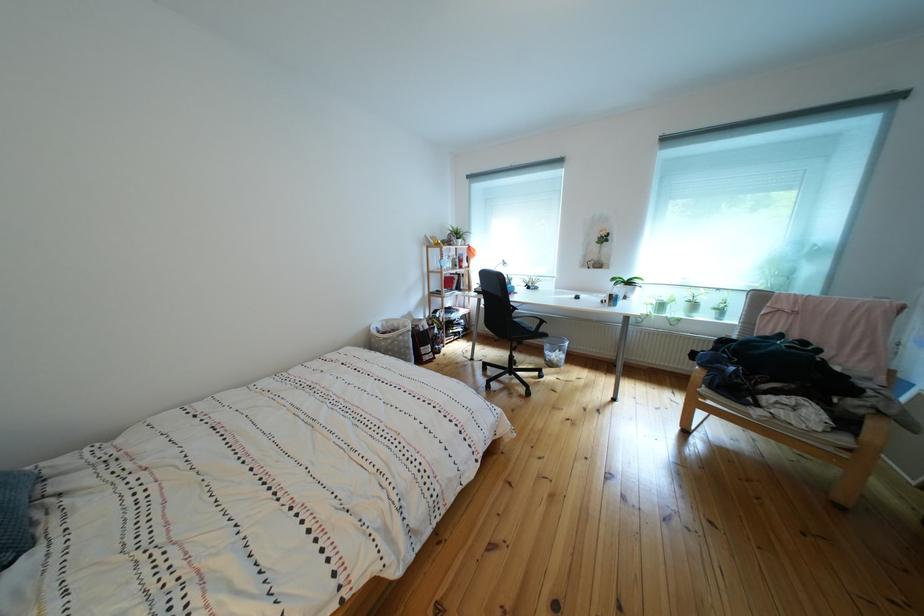
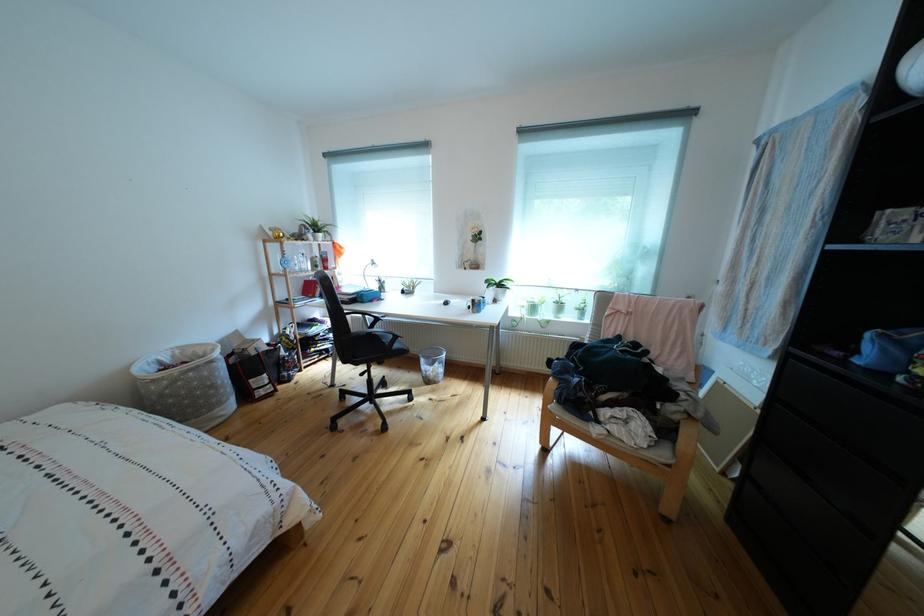
Question: Based on the continuous images, in which direction is the camera rotating? Reply with the corresponding letter.

Choices:
 (A) Left
 (B) Right
 (C) Up
 (D) Down

Answer: (B)